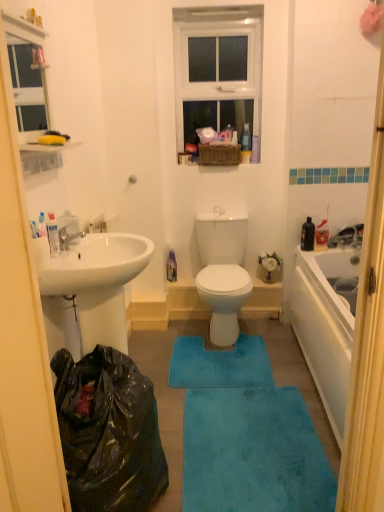
Question: Can you confirm if white plastic toothpaste tube at left is positioned to the left of blue plush bath mat at center, which ranks as the second bath mat in bottom-to-top order?

Choices:
 (A) yes
 (B) no

Answer: (A)

Question: Is white plastic toothpaste tube at left shorter than blue plush bath mat at center, which is the 1th bath mat in back-to-front order?

Choices:
 (A) yes
 (B) no

Answer: (B)

Question: From a real-world perspective, is white plastic toothpaste tube at left located higher than blue plush bath mat at center, which is the second bath mat from front to back?

Choices:
 (A) no
 (B) yes

Answer: (B)

Question: Can you see white plastic toothpaste tube at left touching blue plush bath mat at center, which is the second bath mat from front to back?

Choices:
 (A) no
 (B) yes

Answer: (A)

Question: Is white plastic toothpaste tube at left turned away from blue plush bath mat at center, which is the second bath mat from front to back?

Choices:
 (A) no
 (B) yes

Answer: (A)

Question: In terms of size, does white plastic window at upper center appear bigger or smaller than white plastic toothpaste tube at left?

Choices:
 (A) small
 (B) big

Answer: (B)

Question: In the image, is white plastic window at upper center positioned in front of or behind white plastic toothpaste tube at left?

Choices:
 (A) behind
 (B) front

Answer: (A)

Question: From a real-world perspective, is white plastic window at upper center above or below white plastic toothpaste tube at left?

Choices:
 (A) below
 (B) above

Answer: (B)

Question: From the image's perspective, is white plastic window at upper center positioned above or below white plastic toothpaste tube at left?

Choices:
 (A) below
 (B) above

Answer: (B)

Question: Is black plastic bag at lower left wider or thinner than white plastic toothpaste tube at left?

Choices:
 (A) wide
 (B) thin

Answer: (A)

Question: Relative to white plastic toothpaste tube at left, is black plastic bag at lower left in front or behind?

Choices:
 (A) front
 (B) behind

Answer: (A)

Question: Considering the positions of black plastic bag at lower left and white plastic toothpaste tube at left in the image, is black plastic bag at lower left taller or shorter than white plastic toothpaste tube at left?

Choices:
 (A) short
 (B) tall

Answer: (B)

Question: From the image's perspective, is black plastic bag at lower left located above or below white plastic toothpaste tube at left?

Choices:
 (A) below
 (B) above

Answer: (A)

Question: From a real-world perspective, is white plastic toothpaste tube at left positioned above or below blue plush bath mat at center, which appears as the 1th bath mat when viewed from the top?

Choices:
 (A) below
 (B) above

Answer: (B)

Question: Considering the relative positions of white plastic toothpaste tube at left and blue plush bath mat at center, which is the second bath mat from front to back, in the image provided, is white plastic toothpaste tube at left to the left or to the right of blue plush bath mat at center, which is the second bath mat from front to back,?

Choices:
 (A) left
 (B) right

Answer: (A)